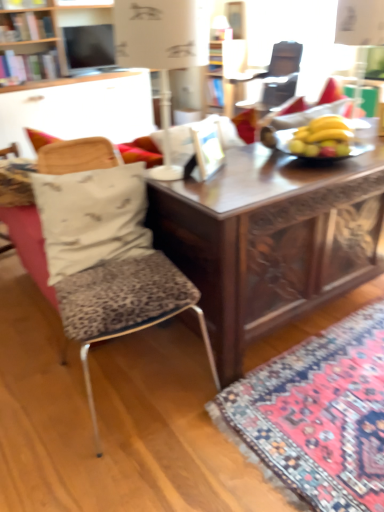
At what (x,y) coordinates should I click in order to perform the action: click on vacant area that lies to the right of white paper lampshade at upper center. Please return your answer as a coordinate pair (x, y). This screenshot has width=384, height=512. Looking at the image, I should click on (248, 165).